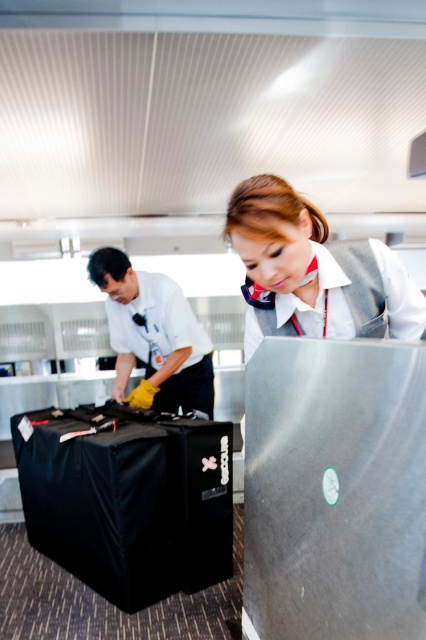
You are a maintenance worker in the baggage area. You need to reach a control panel located above the gray fabric vest at center. Can you use the yellow rubber gloves at left to help you reach it?

The gray fabric vest at center is not as tall as yellow rubber gloves at left, so the yellow rubber gloves at left are taller. Since the control panel is above the gray fabric vest at center, the yellow rubber gloves at left might be within reach if they are positioned higher.

From the picture: You are a security camera positioned at the ceiling of the baggage handling area. You need to locate the gray fabric vest at center. What are its coordinates?

The gray fabric vest at center is located at coordinates point (x=311, y=269).